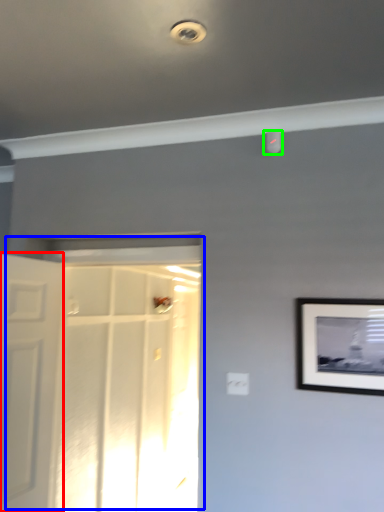
Question: Which object is the closest to the door (highlighted by a red box)? Choose among these: door (highlighted by a blue box) or droplight (highlighted by a green box).

Choices:
 (A) door
 (B) droplight

Answer: (A)